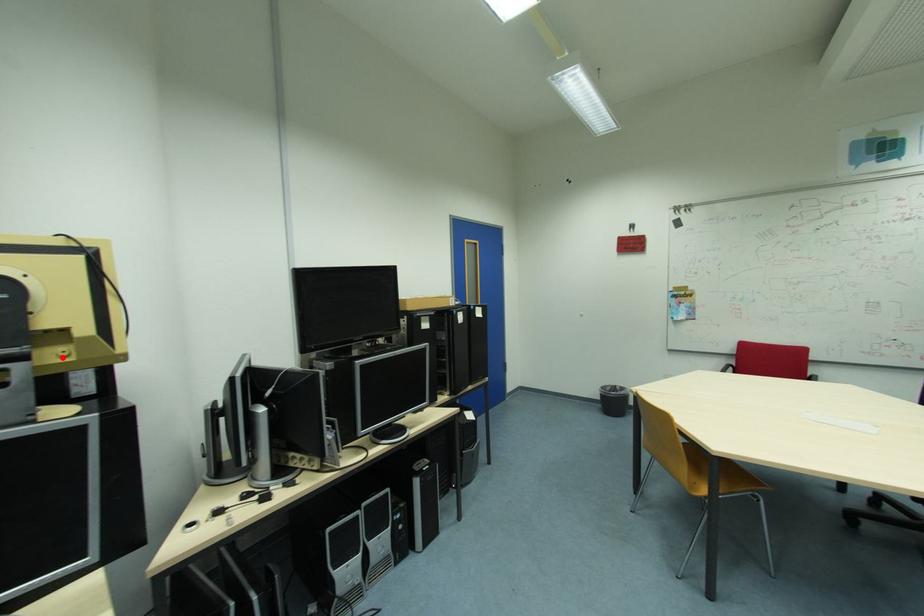
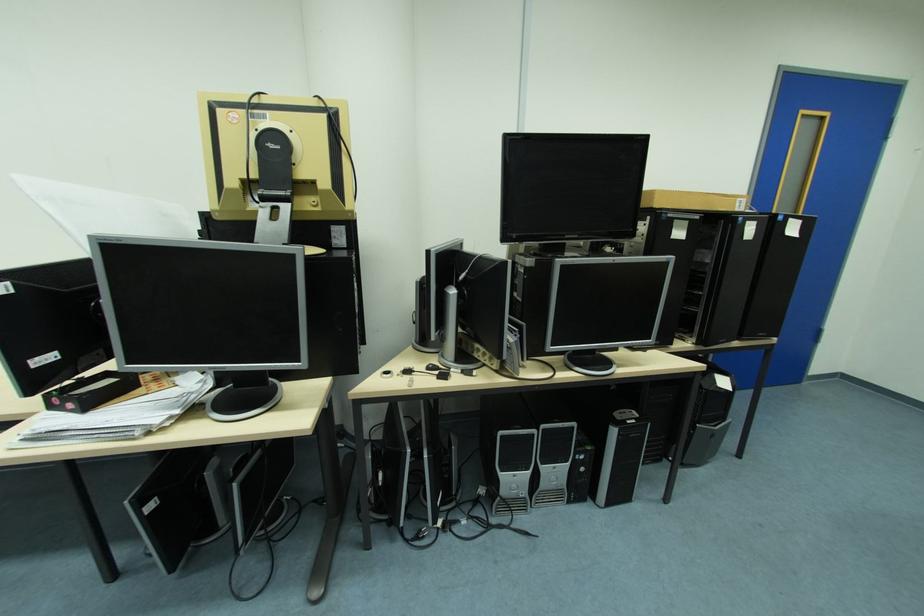
The point at the highlighted location is marked in the first image. Where is the corresponding point in the second image?

(315, 205)